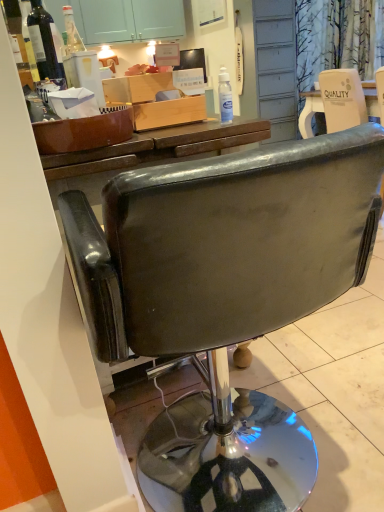
Question: From the image's perspective, is white paper bag at upper right on top of matte black television at upper center?

Choices:
 (A) yes
 (B) no

Answer: (B)

Question: Is white paper bag at upper right smaller than matte black television at upper center?

Choices:
 (A) yes
 (B) no

Answer: (B)

Question: From a real-world perspective, does white paper bag at upper right sit lower than matte black television at upper center?

Choices:
 (A) yes
 (B) no

Answer: (A)

Question: Would you say white paper bag at upper right is a long distance from matte black television at upper center?

Choices:
 (A) no
 (B) yes

Answer: (B)

Question: Are white paper bag at upper right and matte black television at upper center making contact?

Choices:
 (A) yes
 (B) no

Answer: (B)

Question: Does white paper bag at upper right have a larger size compared to matte black television at upper center?

Choices:
 (A) no
 (B) yes

Answer: (B)

Question: From the image's perspective, does transparent plastic bottle at upper center, positioned as the second bottle in left-to-right order, appear higher than dark glass bottle at upper left, which is the first bottle from top to bottom?

Choices:
 (A) yes
 (B) no

Answer: (B)

Question: From the image's perspective, is transparent plastic bottle at upper center, marked as the first bottle in a bottom-to-top arrangement, below dark glass bottle at upper left, which is the 2th bottle in bottom-to-top order?

Choices:
 (A) no
 (B) yes

Answer: (B)

Question: Is the position of transparent plastic bottle at upper center, placed as the second bottle when sorted from top to bottom, more distant than that of dark glass bottle at upper left, which is the 2th bottle in bottom-to-top order?

Choices:
 (A) yes
 (B) no

Answer: (A)

Question: Considering the relative sizes of transparent plastic bottle at upper center, marked as the first bottle in a bottom-to-top arrangement, and dark glass bottle at upper left, which is the first bottle in left-to-right order, in the image provided, is transparent plastic bottle at upper center, marked as the first bottle in a bottom-to-top arrangement, thinner than dark glass bottle at upper left, which is the first bottle in left-to-right order,?

Choices:
 (A) yes
 (B) no

Answer: (A)

Question: From a real-world perspective, is transparent plastic bottle at upper center, which is the first bottle from right to left, positioned over dark glass bottle at upper left, which is the first bottle in left-to-right order, based on gravity?

Choices:
 (A) yes
 (B) no

Answer: (B)

Question: Considering the relative positions of transparent plastic bottle at upper center, positioned as the second bottle in left-to-right order, and dark glass bottle at upper left, which is the second bottle in right-to-left order, in the image provided, is transparent plastic bottle at upper center, positioned as the second bottle in left-to-right order, to the right of dark glass bottle at upper left, which is the second bottle in right-to-left order, from the viewer's perspective?

Choices:
 (A) yes
 (B) no

Answer: (A)

Question: From a real-world perspective, is matte black television at upper center physically below transparent plastic bottle at upper center, positioned as the second bottle in left-to-right order?

Choices:
 (A) no
 (B) yes

Answer: (A)